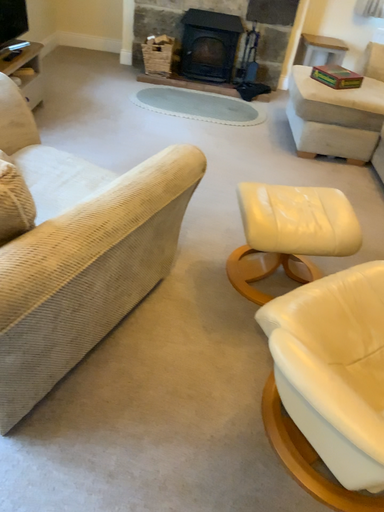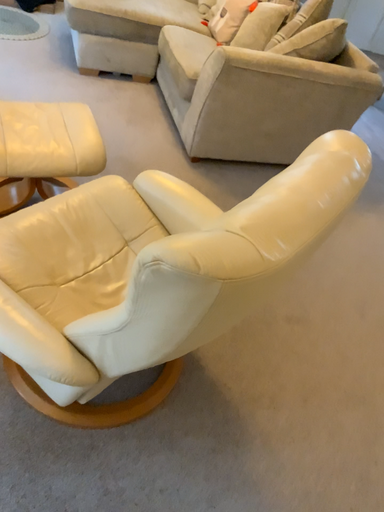
Question: How did the camera likely rotate when shooting the video?

Choices:
 (A) rotated downward
 (B) rotated upward

Answer: (A)